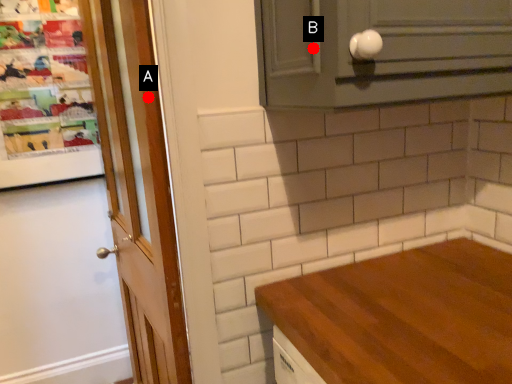
Question: Two points are circled on the image, labeled by A and B beside each circle. Which point is closer to the camera?

Choices:
 (A) A is closer
 (B) B is closer

Answer: (B)